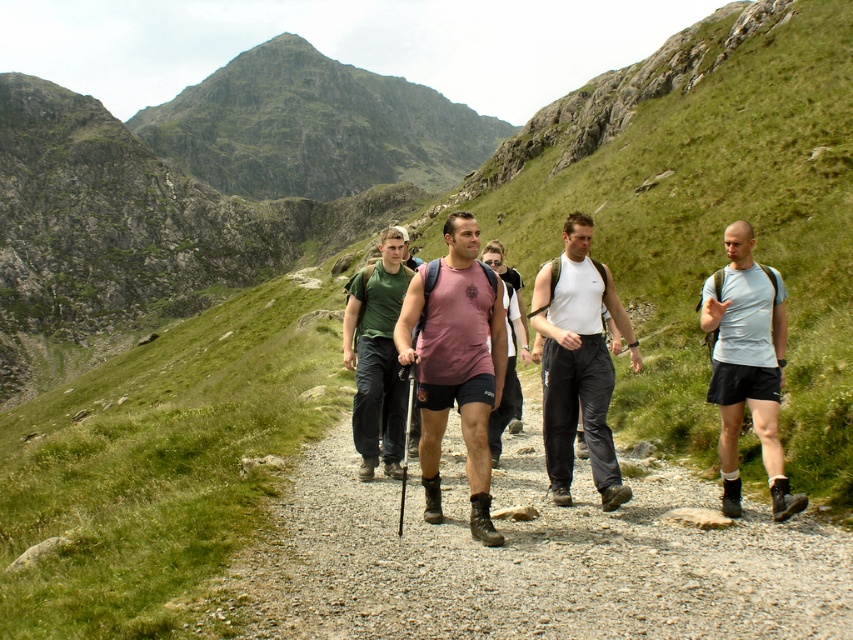
Question: Is pink fabric tank top at center positioned at the back of white matte shirt at center?

Choices:
 (A) no
 (B) yes

Answer: (A)

Question: Does rugged granite peak at upper center lie in front of green fabric shirt at center?

Choices:
 (A) no
 (B) yes

Answer: (A)

Question: Is white matte shirt at center to the left of green fabric shirt at center from the viewer's perspective?

Choices:
 (A) no
 (B) yes

Answer: (A)

Question: Based on their relative distances, which object is farther from the rugged granite peak at upper center?

Choices:
 (A) white matte shirt at center
 (B) green fabric shirt at center

Answer: (A)

Question: Which of the following is the farthest from the observer?

Choices:
 (A) rugged granite peak at upper center
 (B) white matte shirt at center

Answer: (A)

Question: Estimate the real-world distances between objects in this image. Which object is closer to the rugged granite peak at upper center?

Choices:
 (A) dirt/gravel path at center
 (B) white matte shirt at center
 (C) pink fabric tank top at center

Answer: (A)